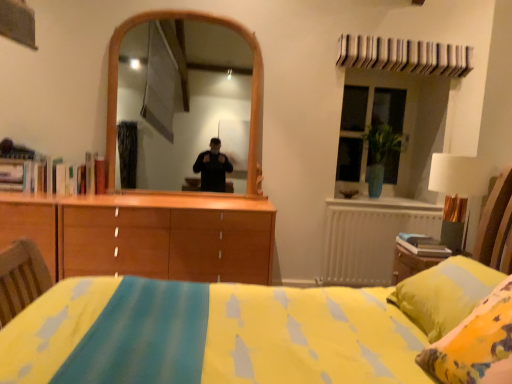
Question: Does white metallic radiator at right lie behind white fabric lampshade at right?

Choices:
 (A) no
 (B) yes

Answer: (B)

Question: Is white metallic radiator at right positioned far away from white fabric lampshade at right?

Choices:
 (A) yes
 (B) no

Answer: (A)

Question: From the image's perspective, does white metallic radiator at right appear lower than white fabric lampshade at right?

Choices:
 (A) yes
 (B) no

Answer: (A)

Question: Can you confirm if white metallic radiator at right is thinner than white fabric lampshade at right?

Choices:
 (A) yes
 (B) no

Answer: (A)

Question: Does white metallic radiator at right appear on the left side of white fabric lampshade at right?

Choices:
 (A) no
 (B) yes

Answer: (B)

Question: In terms of size, does green glass vase at upper right appear bigger or smaller than white metallic radiator at right?

Choices:
 (A) big
 (B) small

Answer: (A)

Question: Is green glass vase at upper right taller or shorter than white metallic radiator at right?

Choices:
 (A) tall
 (B) short

Answer: (A)

Question: Would you say green glass vase at upper right is inside or outside white metallic radiator at right?

Choices:
 (A) inside
 (B) outside

Answer: (B)

Question: Is green glass vase at upper right wider or thinner than white metallic radiator at right?

Choices:
 (A) wide
 (B) thin

Answer: (A)

Question: In terms of width, does white metallic radiator at right look wider or thinner when compared to white fabric lampshade at right?

Choices:
 (A) thin
 (B) wide

Answer: (A)

Question: From the image's perspective, is white metallic radiator at right located above or below white fabric lampshade at right?

Choices:
 (A) above
 (B) below

Answer: (B)

Question: Is white metallic radiator at right in front of or behind white fabric lampshade at right in the image?

Choices:
 (A) front
 (B) behind

Answer: (B)

Question: Is point (381, 213) positioned closer to the camera than point (443, 190)?

Choices:
 (A) farther
 (B) closer

Answer: (A)

Question: From the image's perspective, is green glass vase at upper right above or below white fabric lampshade at right?

Choices:
 (A) below
 (B) above

Answer: (B)

Question: From a real-world perspective, is green glass vase at upper right physically located above or below white fabric lampshade at right?

Choices:
 (A) above
 (B) below

Answer: (A)